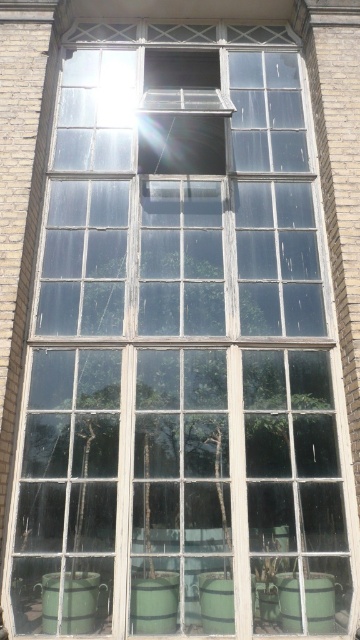
You are a delivery person trying to place a package that is 16 inches wide between the green wooden barrel at lower right and the green wooden barrel at lower center. Can you fit the package between them?

The green wooden barrel at lower right and green wooden barrel at lower center are 15.43 inches apart from each other, so the package that is 16 inches wide cannot fit between them.

Consider the image. You are a delivery person trying to place a large package between the green wooden barrel at lower left and the green wooden barrel at lower right. Can you determine which barrel is wider to ensure the package fits?

The green wooden barrel at lower left might be wider than green wooden barrel at lower right, so you should check the width of the green wooden barrel at lower left first to ensure the package fits properly.

In the scene shown: You are standing in front of the window and notice two points marked on the window glass. The first point is at coordinates point (74, 598) and the second is at point (293, 592). Which of these two points appears closer to you?

Point (74, 598) is closer to the camera than point (293, 592), so it appears closer to you.